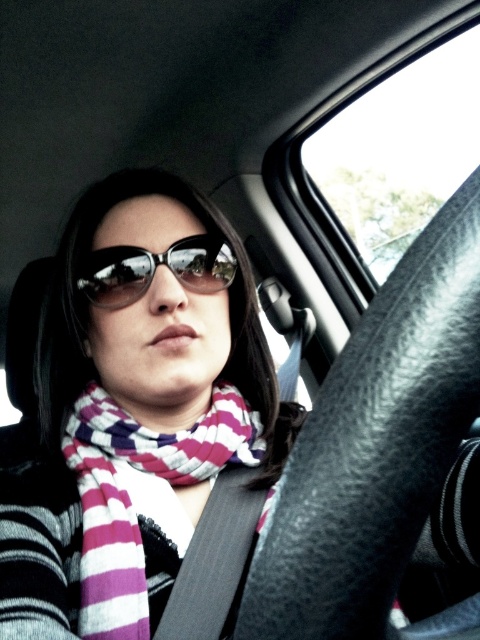
Question: Which of the following is the farthest from the observer?

Choices:
 (A) (119, 250)
 (B) (142, 200)
 (C) (74, 432)

Answer: (B)

Question: Which point is closer to the camera?

Choices:
 (A) black reflective sunglasses at center
 (B) striped scarf at center

Answer: (B)

Question: Where is striped scarf at center located in relation to black reflective sunglasses at center in the image?

Choices:
 (A) left
 (B) right

Answer: (A)

Question: Which object is closer to the camera taking this photo?

Choices:
 (A) black reflective sunglasses at center
 (B) striped scarf at center

Answer: (B)

Question: Is striped scarf at center above purple striped scarf at center?

Choices:
 (A) no
 (B) yes

Answer: (B)

Question: Does striped scarf at center have a lesser width compared to black reflective sunglasses at center?

Choices:
 (A) yes
 (B) no

Answer: (B)